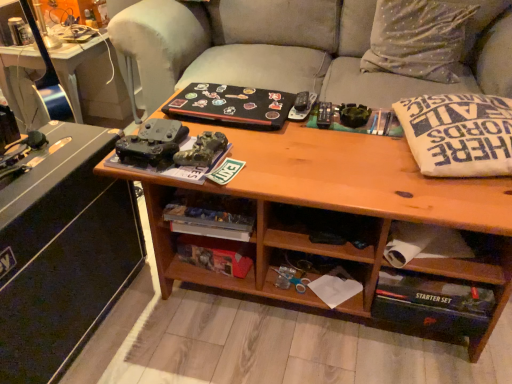
Question: Are wooden drawer at lower right and matte black desk at left far apart?

Choices:
 (A) yes
 (B) no

Answer: (B)

Question: Is wooden drawer at lower right positioned with its back to matte black desk at left?

Choices:
 (A) yes
 (B) no

Answer: (B)

Question: From the image's perspective, is wooden drawer at lower right on matte black desk at left?

Choices:
 (A) no
 (B) yes

Answer: (B)

Question: Is the depth of wooden drawer at lower right greater than that of matte black desk at left?

Choices:
 (A) no
 (B) yes

Answer: (B)

Question: From the image's perspective, would you say wooden drawer at lower right is shown under matte black desk at left?

Choices:
 (A) yes
 (B) no

Answer: (B)

Question: From a real-world perspective, is wooden drawer at lower right located beneath matte black desk at left?

Choices:
 (A) no
 (B) yes

Answer: (A)

Question: Could you tell me if white cotton pillow at right is facing hardcover book at lower center, positioned as the 2th book in top-to-bottom order?

Choices:
 (A) no
 (B) yes

Answer: (A)

Question: Does white cotton pillow at right appear on the right side of hardcover book at lower center, which is the first book from bottom to top?

Choices:
 (A) yes
 (B) no

Answer: (A)

Question: Does white cotton pillow at right have a larger size compared to hardcover book at lower center, positioned as the 2th book in top-to-bottom order?

Choices:
 (A) yes
 (B) no

Answer: (A)

Question: From a real-world perspective, is white cotton pillow at right over hardcover book at lower center, which is the first book from bottom to top?

Choices:
 (A) yes
 (B) no

Answer: (A)

Question: Is white cotton pillow at right further to the viewer compared to hardcover book at lower center, which is the first book from bottom to top?

Choices:
 (A) no
 (B) yes

Answer: (A)

Question: Can you confirm if white cotton pillow at right is taller than hardcover book at lower center, which is the first book from bottom to top?

Choices:
 (A) no
 (B) yes

Answer: (B)

Question: From the image's perspective, is silky silver pillow at upper right above hardcover book at lower center, positioned as the 2th book in top-to-bottom order?

Choices:
 (A) no
 (B) yes

Answer: (B)